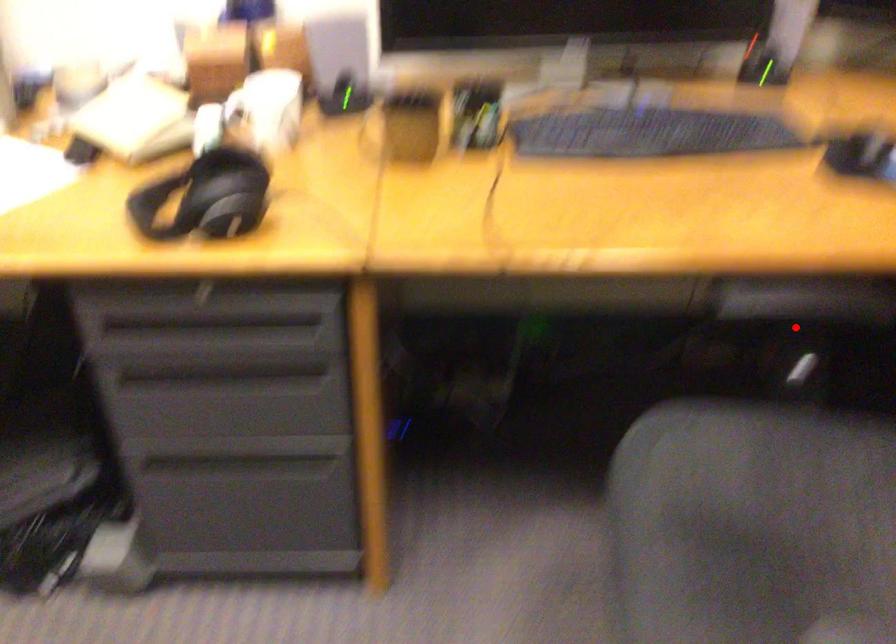
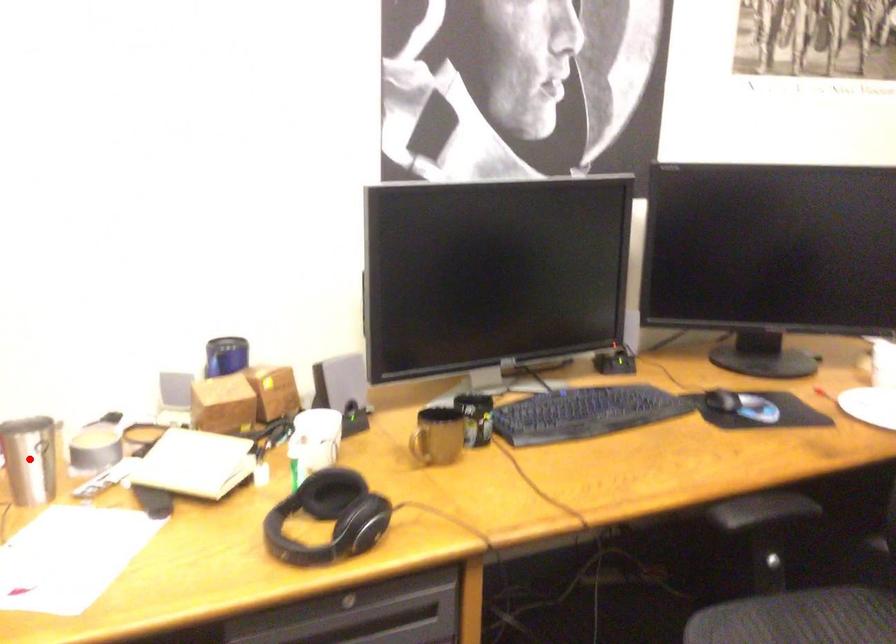
I am providing you with two images of the same scene from different viewpoints. A red point is marked on the first image and another point is marked on the second image. Does the point marked in image1 correspond to the same location as the one in image2?

No